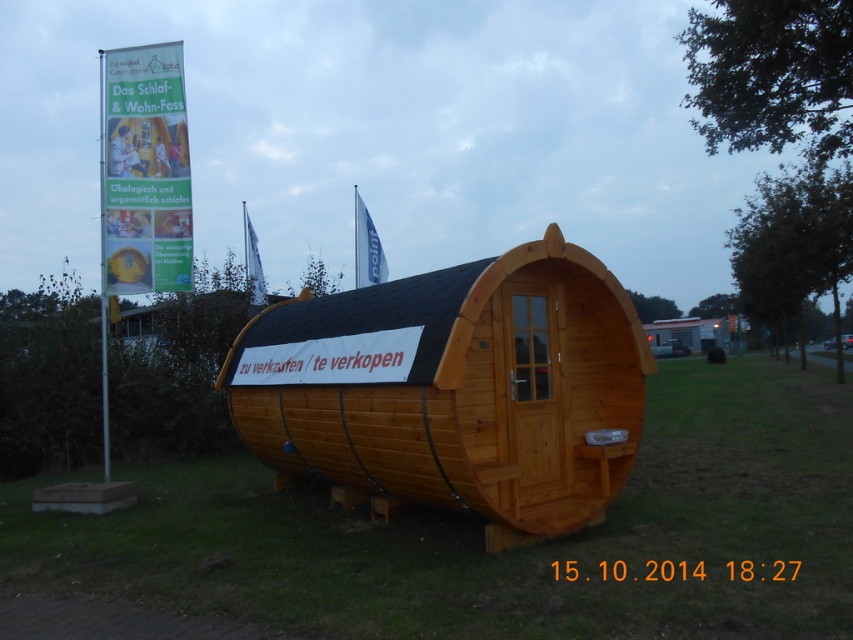
Is green grass at center bigger than wooden cabin at center?

Yes, green grass at center is bigger than wooden cabin at center.

Is point (715, 586) positioned behind point (538, 401)?

No, (715, 586) is closer to viewer.

Where is `green grass at center`? The height and width of the screenshot is (640, 853). green grass at center is located at coordinates (508, 552).

Locate an element on the screen. Image resolution: width=853 pixels, height=640 pixels. green grass at center is located at coordinates (508, 552).

Which is above, green grass at center or white paper banner at upper left?

white paper banner at upper left is above.

Between point (796, 388) and point (186, 152), which one is positioned behind?

Point (796, 388)

Find the location of a particular element. The height and width of the screenshot is (640, 853). green grass at center is located at coordinates (508, 552).

Is wooden cabin at center to the left of white paper banner at upper left from the viewer's perspective?

Incorrect, wooden cabin at center is not on the left side of white paper banner at upper left.

Between wooden cabin at center and white paper banner at upper left, which one appears on the left side from the viewer's perspective?

From the viewer's perspective, white paper banner at upper left appears more on the left side.

Find the location of `wooden cabin at center`. wooden cabin at center is located at coordinates (454, 387).